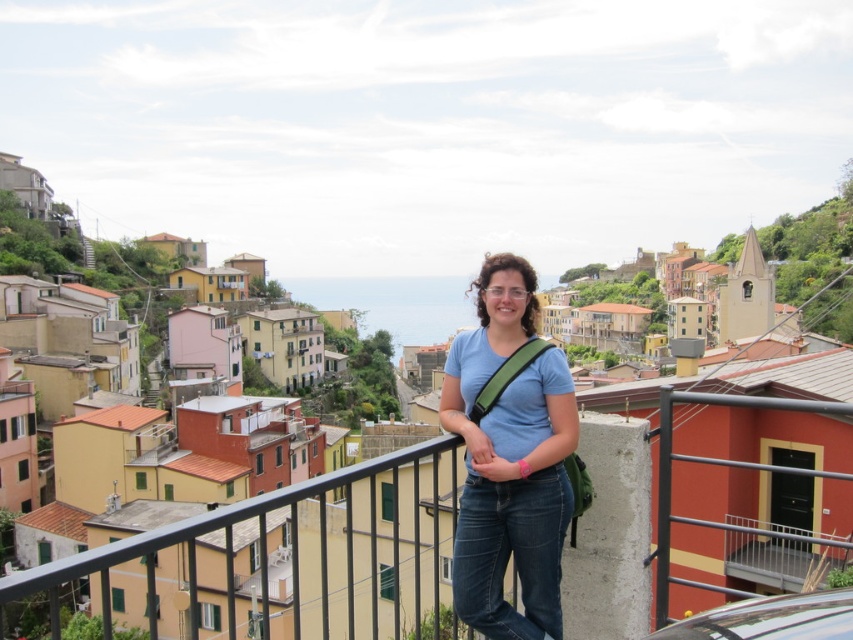
Question: Which point is farther to the camera?

Choices:
 (A) matte blue shirt at center
 (B) metallic gray railing at lower right

Answer: (A)

Question: Among these points, which one is farthest from the camera?

Choices:
 (A) (836, 564)
 (B) (567, 397)

Answer: (A)

Question: Is matte blue shirt at center bigger than metallic gray railing at lower right?

Choices:
 (A) yes
 (B) no

Answer: (B)

Question: Does matte blue shirt at center appear under metallic gray railing at lower right?

Choices:
 (A) yes
 (B) no

Answer: (B)

Question: Does matte blue shirt at center have a greater width compared to metallic gray railing at lower right?

Choices:
 (A) yes
 (B) no

Answer: (B)

Question: Among these objects, which one is nearest to the camera?

Choices:
 (A) matte blue shirt at center
 (B) metallic gray railing at lower right

Answer: (B)